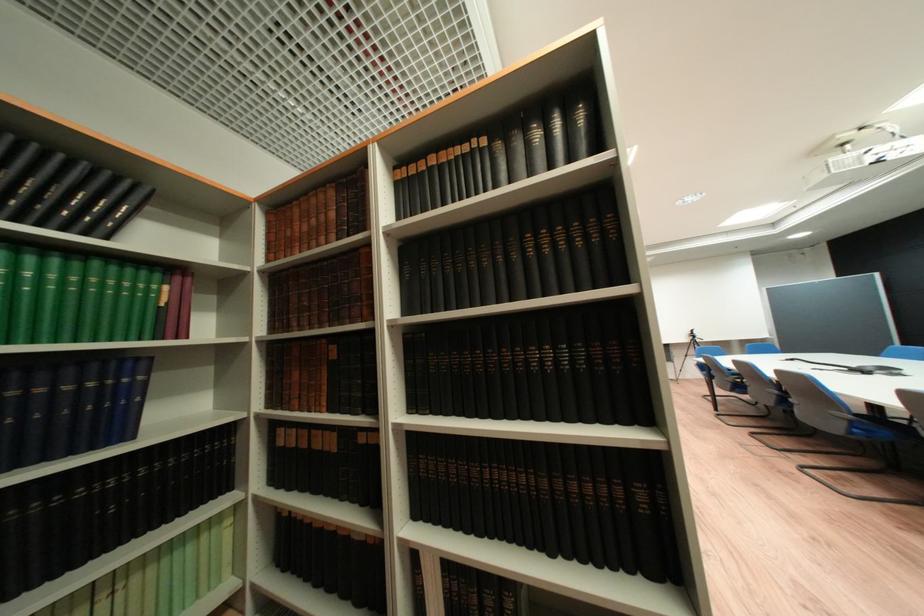
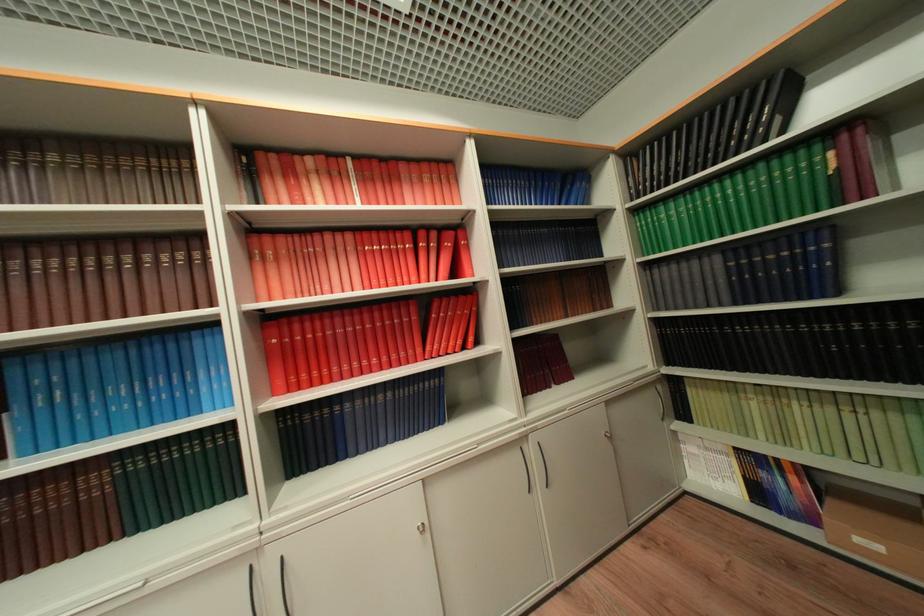
The point at [143,378] is marked in the first image. Where is the corresponding point in the second image?

(829, 246)